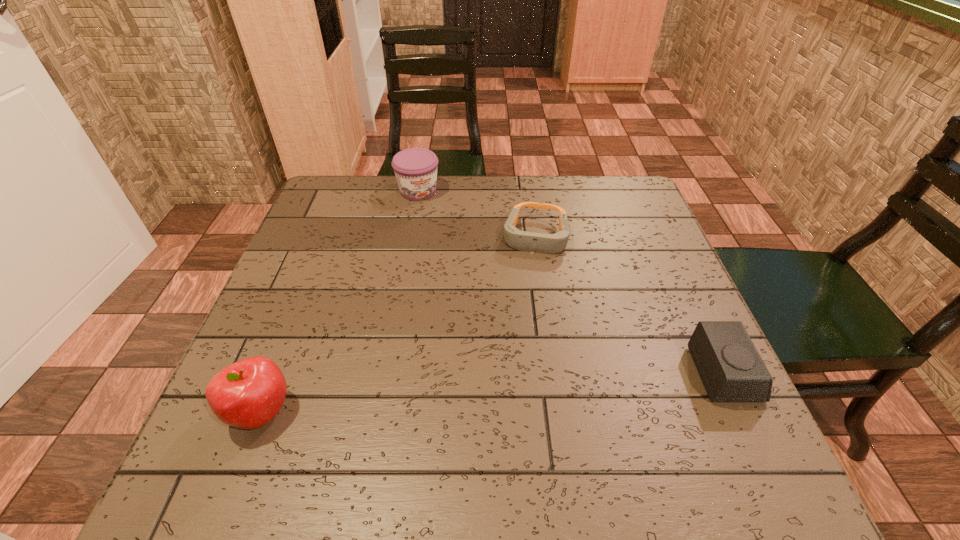
You are a GUI agent. You are given a task and a screenshot of the screen. Output one action in this format:
    pyautogui.click(x=<x>, y=<y>)
    Task: Click on the vacant space on the desktop that is between the apple and the third tallest object and is positioned on the front and back of the third nearest object
    
    Given the screenshot: What is the action you would take?
    coord(510,392)

At what (x,y) coordinates should I click in order to perform the action: click on vacant space on the desktop that is between the tallest object and the rightmost object and is positioned on the front label of the third object from right to left. Please return your answer as a coordinate pair (x, y). The width and height of the screenshot is (960, 540). Looking at the image, I should click on (538, 389).